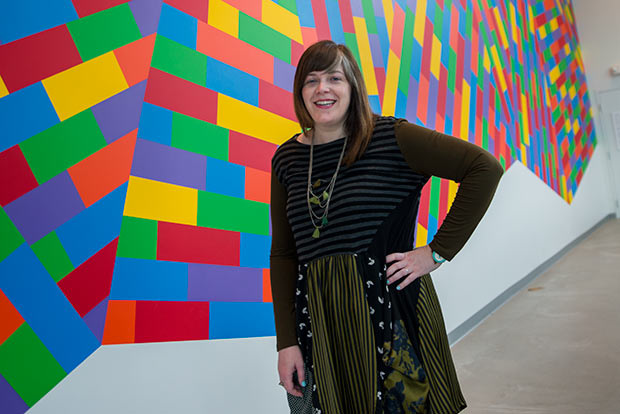
Find the location of a particular element. This screenshot has width=620, height=414. colorful painted wall is located at coordinates (131, 142), (485, 44).